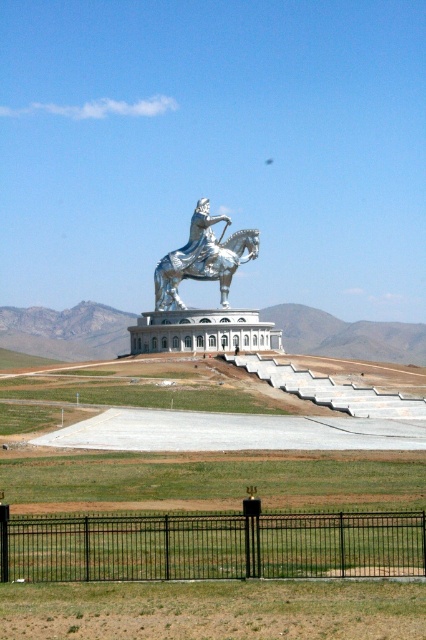
Between point (80, 529) and point (224, 288), which one is positioned behind?

The point (224, 288) is more distant.

Can you confirm if black metal fence at lower center is smaller than silver metallic horse at center?

Correct, black metal fence at lower center occupies less space than silver metallic horse at center.

Who is more forward, (402, 525) or (164, 301)?

Point (402, 525) is more forward.

The image size is (426, 640). I want to click on black metal fence at lower center, so click(x=213, y=547).

Which is above, shiny silver statue at center or silver metallic horse at center?

silver metallic horse at center is higher up.

What do you see at coordinates (201, 280) in the screenshot? Image resolution: width=426 pixels, height=640 pixels. I see `shiny silver statue at center` at bounding box center [201, 280].

Where is `shiny silver statue at center`? The height and width of the screenshot is (640, 426). shiny silver statue at center is located at coordinates (201, 280).

Describe the element at coordinates (213, 547) in the screenshot. I see `black metal fence at lower center` at that location.

Does point (391, 529) lie behind point (226, 321)?

No.

Image resolution: width=426 pixels, height=640 pixels. What do you see at coordinates (213, 547) in the screenshot?
I see `black metal fence at lower center` at bounding box center [213, 547].

Find the location of a particular element. The image size is (426, 640). black metal fence at lower center is located at coordinates (213, 547).